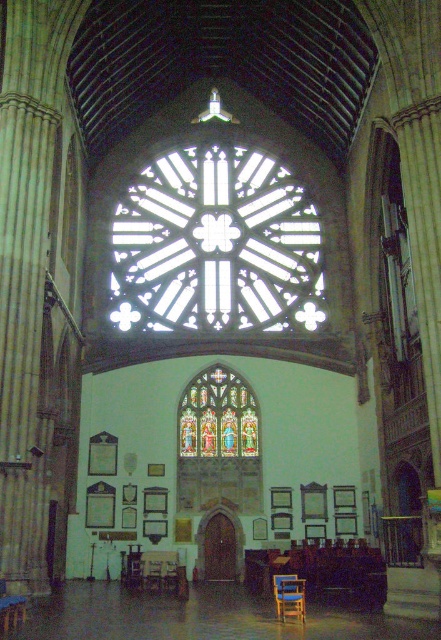
Is clear glass rose window at center bigger than wooden chair at lower center?

Yes, clear glass rose window at center is bigger than wooden chair at lower center.

Is clear glass rose window at center thinner than wooden chair at lower center?

Incorrect, clear glass rose window at center's width is not less than wooden chair at lower center's.

Locate an element on the screen. clear glass rose window at center is located at coordinates (216, 244).

Who is more forward, (x=186, y=218) or (x=197, y=436)?

Point (x=197, y=436) is in front.

The image size is (441, 640). Identify the location of clear glass rose window at center. (216, 244).

The width and height of the screenshot is (441, 640). I want to click on clear glass rose window at center, so click(x=216, y=244).

Is stained glass window at center above wooden chair at lower center?

Indeed, stained glass window at center is positioned over wooden chair at lower center.

Describe the element at coordinates (219, 444) in the screenshot. I see `stained glass window at center` at that location.

Find the location of a particular element. The image size is (441, 640). stained glass window at center is located at coordinates (219, 444).